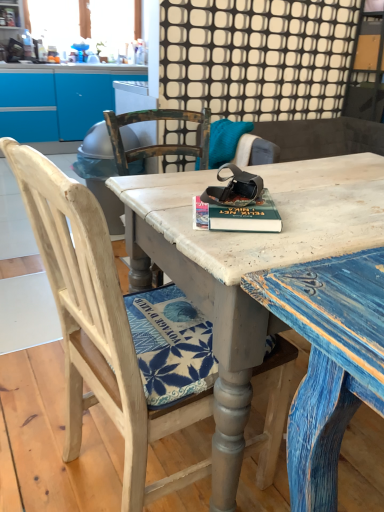
Locate an element on the screen. The width and height of the screenshot is (384, 512). unoccupied region to the right of hardcover book at center is located at coordinates (313, 218).